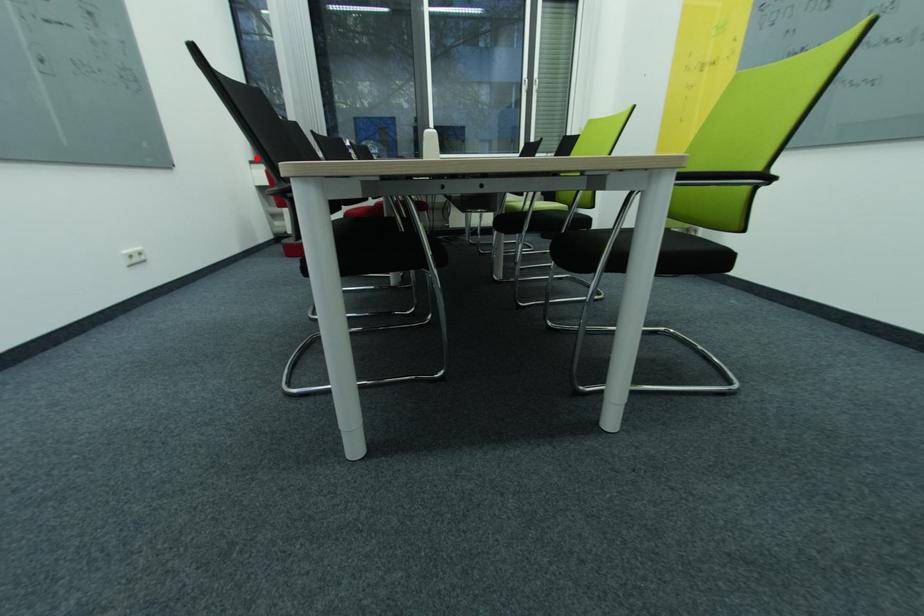
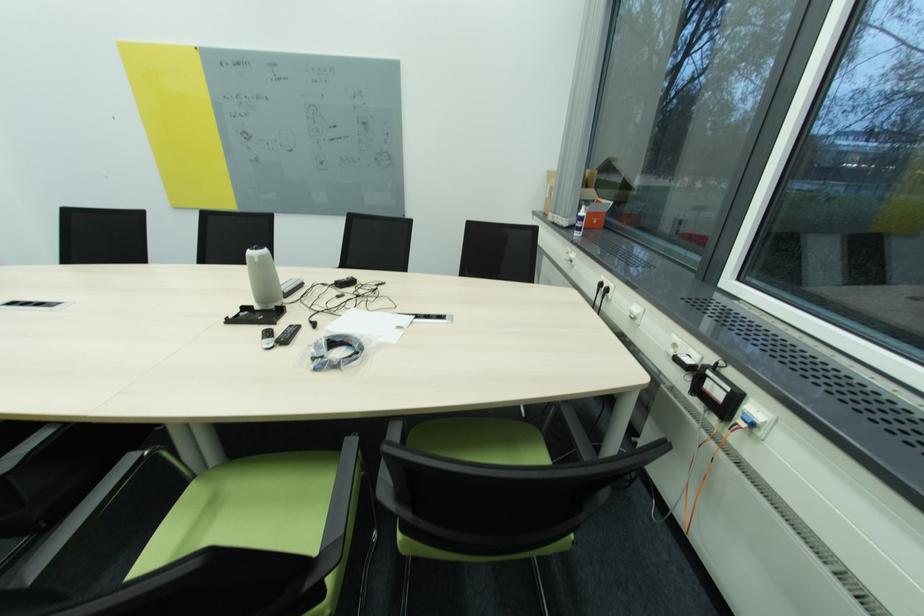
The point at the highlighted location is marked in the first image. Where is the corresponding point in the second image?

(544, 209)